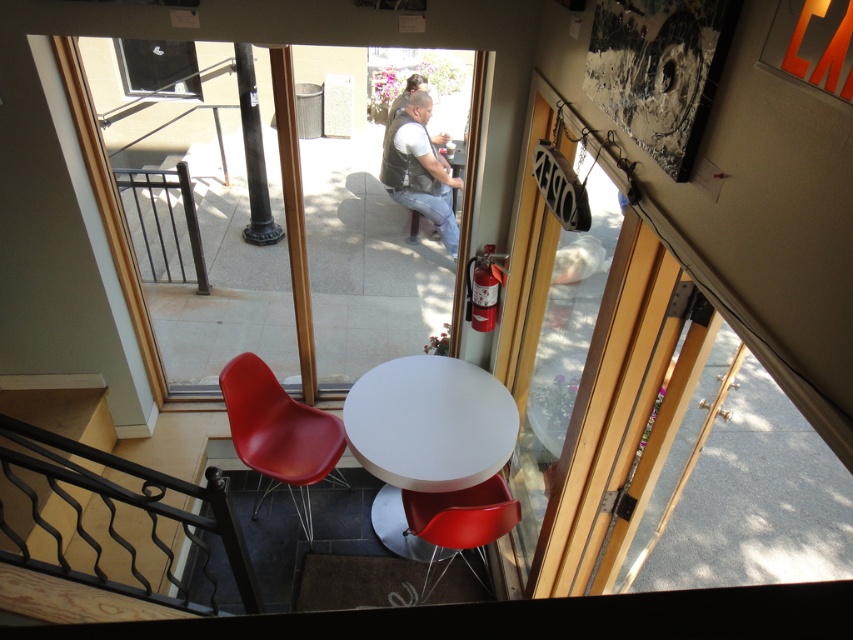
Question: Which object is the closest to the transparent glass door at center?

Choices:
 (A) white glossy table at center
 (B) clear glass window at upper left
 (C) clear glass door at center

Answer: (B)

Question: Among these points, which one is farthest from the camera?

Choices:
 (A) click(x=416, y=141)
 (B) click(x=262, y=470)
 (C) click(x=361, y=100)

Answer: (C)

Question: Which point is farther to the camera?

Choices:
 (A) (296, 413)
 (B) (454, 403)

Answer: (A)

Question: Does transparent glass door at center appear over glossy plastic chair at lower left?

Choices:
 (A) no
 (B) yes

Answer: (B)

Question: Is glossy plastic chair at lower left closer to camera compared to leather vest at center?

Choices:
 (A) yes
 (B) no

Answer: (A)

Question: Is transparent glass door at center positioned before glossy plastic chair at lower left?

Choices:
 (A) yes
 (B) no

Answer: (B)